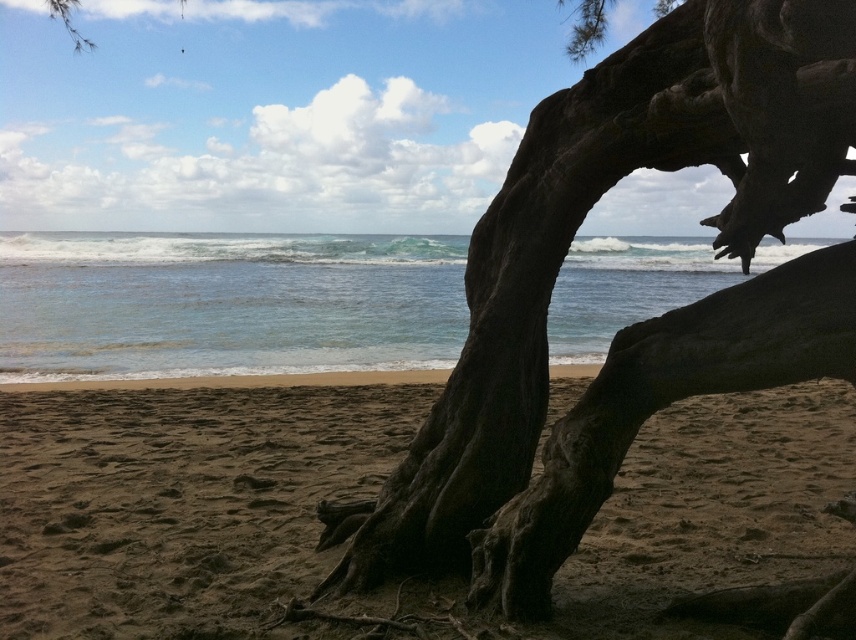
Question: Is brown sandy beach at lower center closer to the viewer compared to clear blue water at center?

Choices:
 (A) no
 (B) yes

Answer: (A)

Question: Which object is closer to the camera taking this photo?

Choices:
 (A) clear blue water at center
 (B) dark brown wood at center
 (C) brown sandy beach at lower center

Answer: (B)

Question: Which point is farther to the camera?

Choices:
 (A) pos(174,269)
 (B) pos(0,424)
 (C) pos(415,557)

Answer: (A)

Question: Is brown sandy beach at lower center below dark brown wood at center?

Choices:
 (A) no
 (B) yes

Answer: (B)

Question: Which point is farther from the camera taking this photo?

Choices:
 (A) (536, 497)
 (B) (114, 429)

Answer: (B)

Question: Does brown sandy beach at lower center have a larger size compared to clear blue water at center?

Choices:
 (A) no
 (B) yes

Answer: (A)